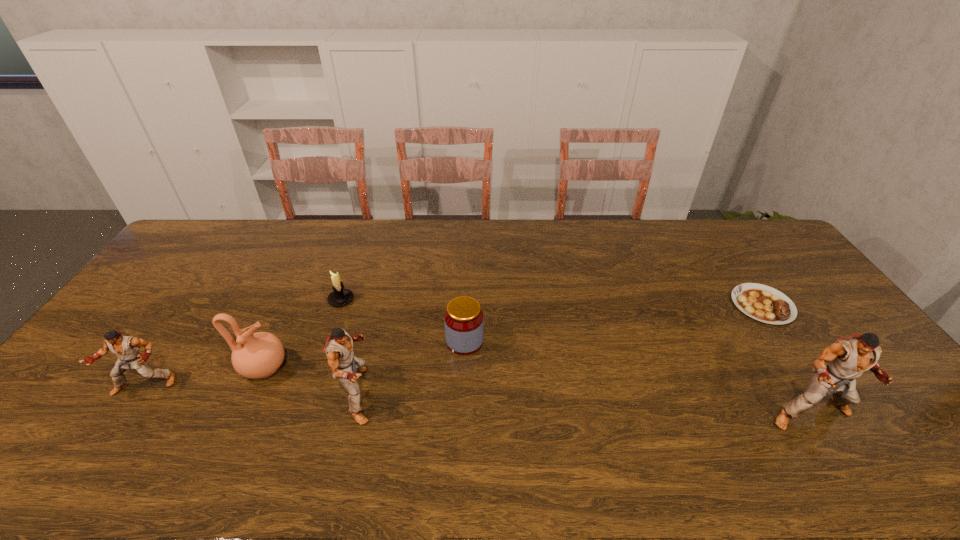
Please point a spot to place another puncher for symmetrical spacing. Please provide its 2D coordinates. Your answer should be formatted as a tuple, i.e. [(x, y)], where the tuple contains the x and y coordinates of a point satisfying the conditions above.

[(580, 404)]